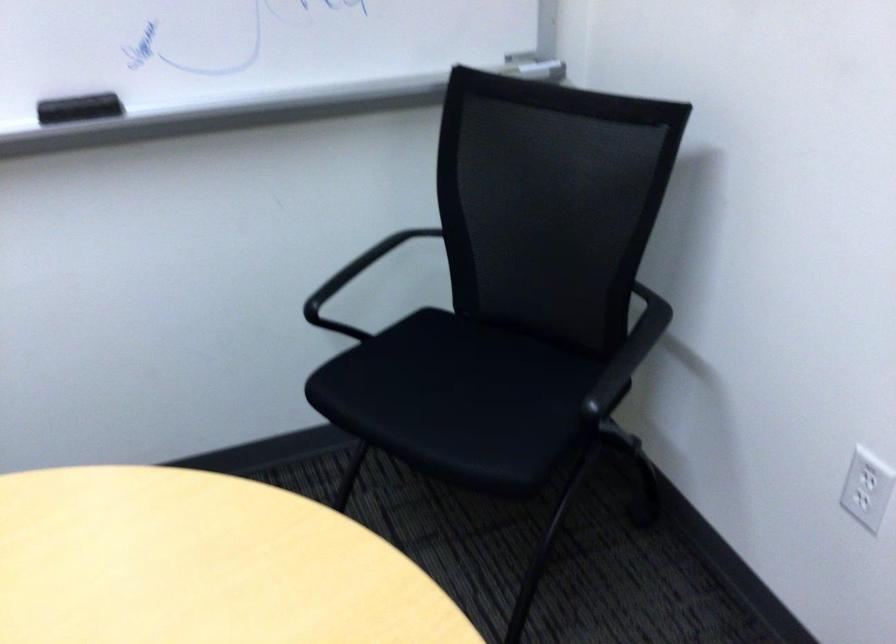
Find where to sit the black chair sitting surface. Please return your answer as a coordinate pair (x, y).

(460, 401)